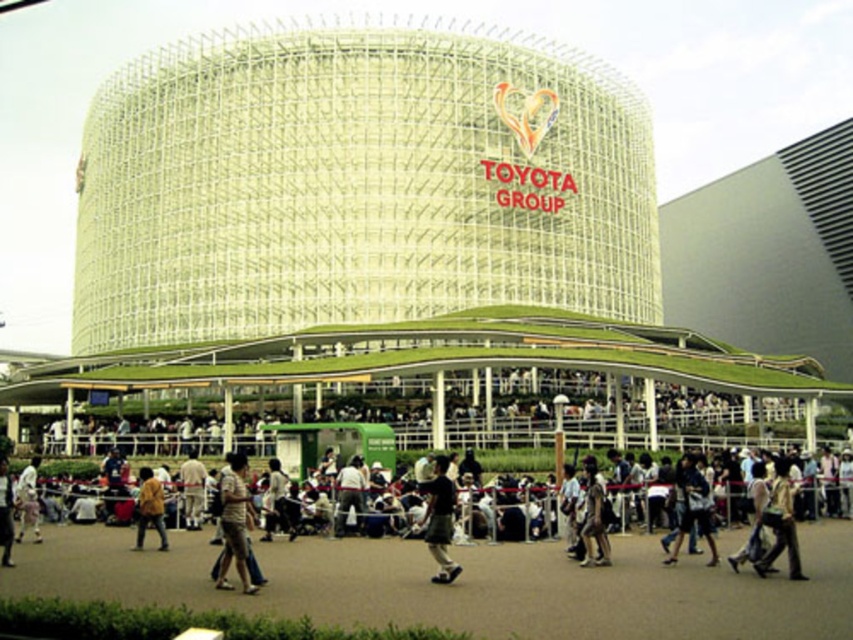
Question: Which object is farther from the camera taking this photo?

Choices:
 (A) brown leather jacket at lower left
 (B) khaki cotton shorts at center
 (C) dark brown leather shoes at lower center
 (D) light brown leather jacket at lower left

Answer: (A)

Question: Does khaki cotton shorts at center have a lesser width compared to light brown leather jacket at lower left?

Choices:
 (A) no
 (B) yes

Answer: (B)

Question: Can you confirm if brown leather jacket at lower left is thinner than white cotton shirt at lower left?

Choices:
 (A) yes
 (B) no

Answer: (A)

Question: Which is nearer to the brown leather jacket at lower left?

Choices:
 (A) camouflage fabric backpack at lower right
 (B) dark brown leather shoes at lower center
 (C) light brown leather jacket at lower left
 (D) light brown fabric shirt at center

Answer: (D)

Question: Among these objects, which one is nearest to the camera?

Choices:
 (A) dark brown leather shoes at lower center
 (B) light brown fabric shirt at center
 (C) light brown leather jacket at lower left
 (D) camouflage fabric backpack at lower right

Answer: (B)

Question: Is khaki cotton shorts at center to the right of dark brown leather shoes at lower center from the viewer's perspective?

Choices:
 (A) no
 (B) yes

Answer: (A)